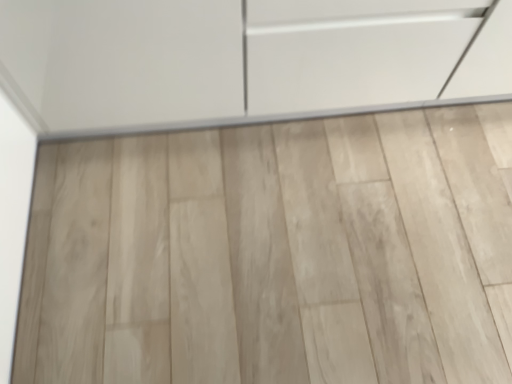
Describe the element at coordinates (275, 254) in the screenshot. I see `natural wood plywood at center` at that location.

Find the location of `natural wood plywood at center`. natural wood plywood at center is located at coordinates (275, 254).

Where is `natural wood plywood at center`? This screenshot has width=512, height=384. natural wood plywood at center is located at coordinates (275, 254).